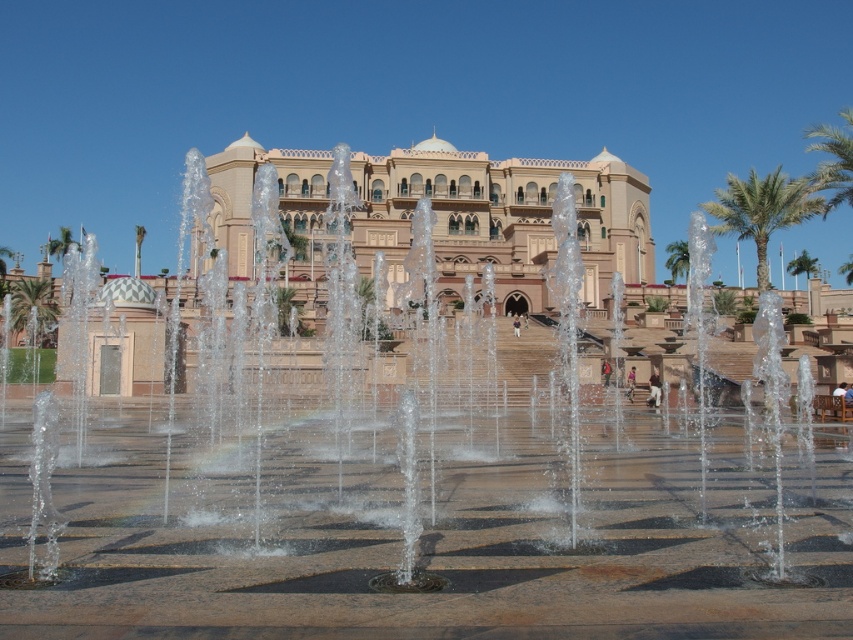
In the scene shown: You are standing at the center of the plaza facing the building. Which direction should you walk to reach the green leafy palm tree at right?

The green leafy palm tree at right is located at the right side of the plaza, so you should walk to your right to reach it.

You are planning to take a photo of the beige stone palace at center and the green leafy palm tree at left from a position where both are visible in the frame. Considering their heights, which object should you position closer to the camera to ensure both are fully visible in the photo?

Since the beige stone palace at center is taller than the green leafy palm tree at left, you should position the beige stone palace at center closer to the camera to ensure both are fully visible in the photo.

You are an architect visiting the beige stone palace at center and the green leafy palm tree at left. You need to determine which structure is bigger in size. Which one is larger?

The beige stone palace at center has a larger size compared to the green leafy palm tree at left, so the beige stone palace at center is larger.